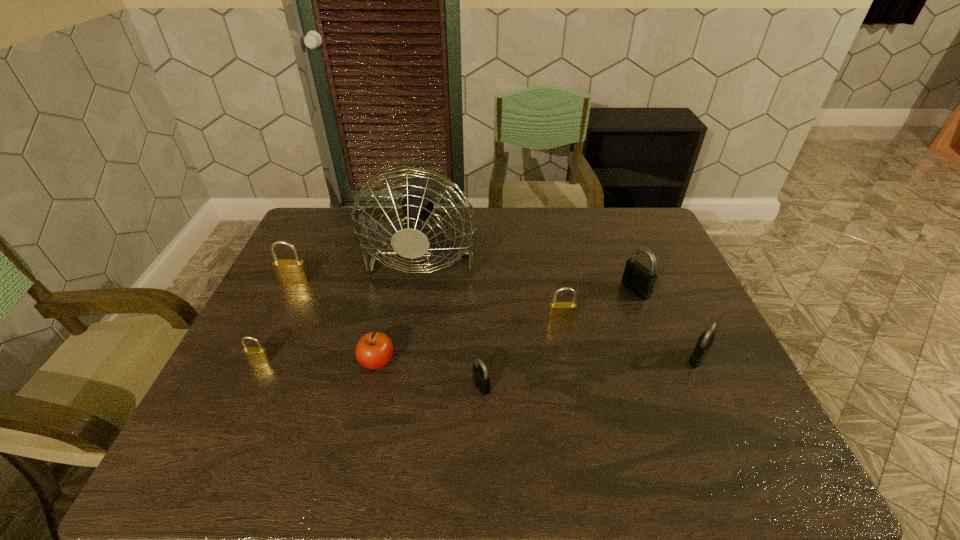
Locate an element on the screen. This screenshot has width=960, height=540. padlock that stands as the second closest to the biggest brass padlock is located at coordinates (481, 379).

Locate an element on the screen. black padlock object that ranks as the closest to the nearest brass padlock is located at coordinates (481, 379).

Locate which black padlock ranks second in proximity to the rightmost object. Please provide its 2D coordinates. Your answer should be formatted as a tuple, i.e. [(x, y)], where the tuple contains the x and y coordinates of a point satisfying the conditions above.

[(481, 379)]

Locate which brass padlock is the second closest to the fourth padlock from right to left. Please provide its 2D coordinates. Your answer should be formatted as a tuple, i.e. [(x, y)], where the tuple contains the x and y coordinates of a point satisfying the conditions above.

[(256, 355)]

Identify which brass padlock is located as the nearest to the smallest brass padlock. Please provide its 2D coordinates. Your answer should be formatted as a tuple, i.e. [(x, y)], where the tuple contains the x and y coordinates of a point satisfying the conditions above.

[(287, 271)]

Image resolution: width=960 pixels, height=540 pixels. Identify the location of vacant space that satisfies the following two spatial constraints: 1. on the front-facing side of the biggest brass padlock; 2. on the right side of the apple. (256, 363).